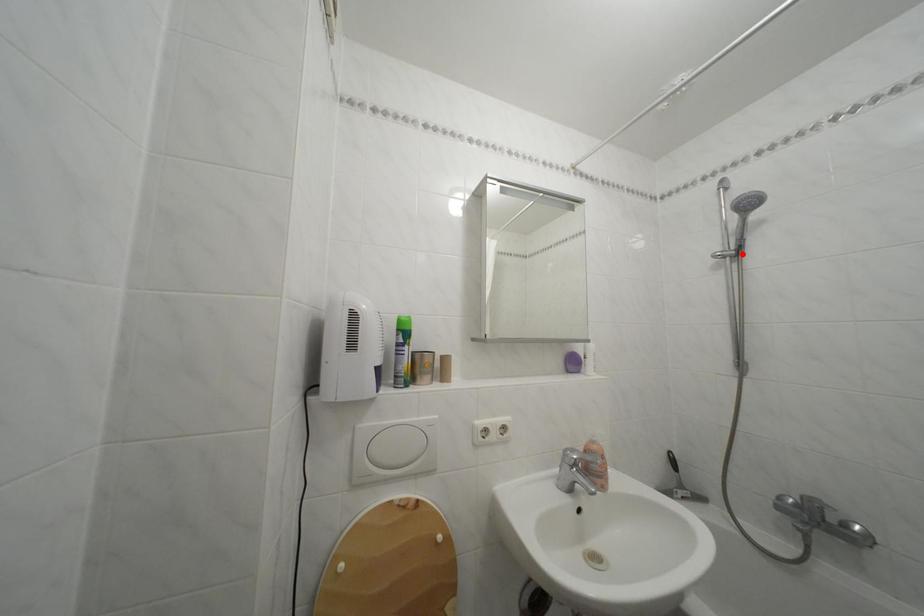
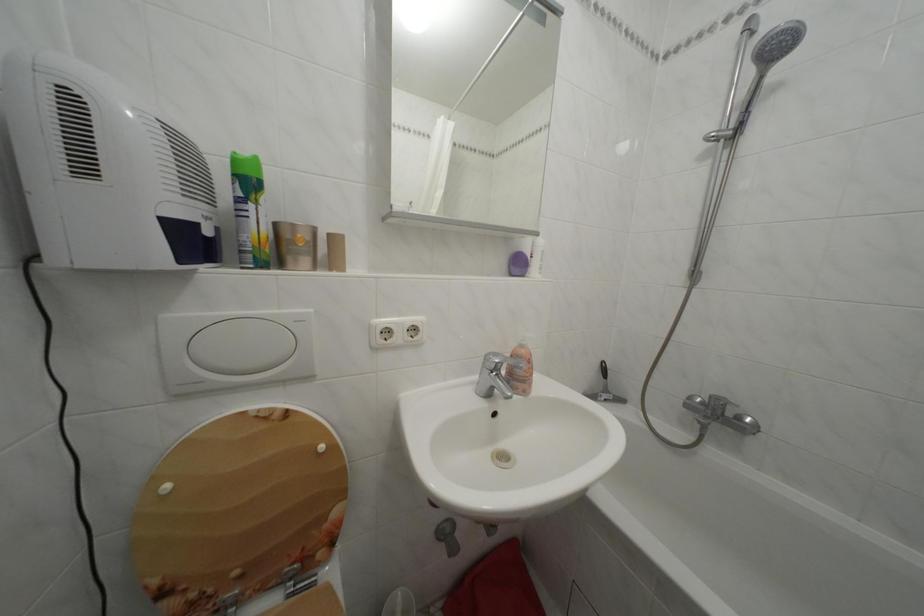
Locate, in the second image, the point that corresponds to the highlighted location in the first image.

(742, 132)